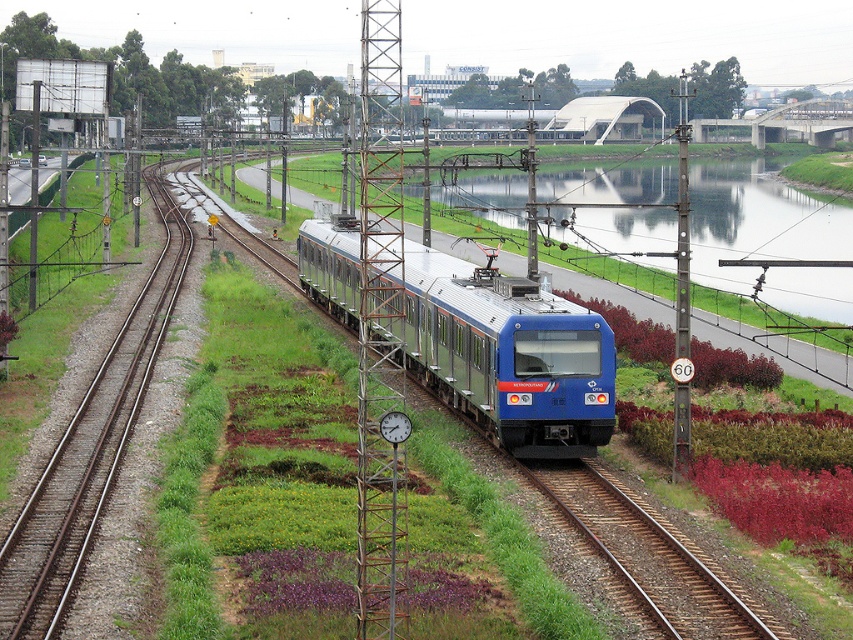
Which of these two, reflective glass waterway at center or blue metallic train at center, stands taller?

reflective glass waterway at center

Can you confirm if reflective glass waterway at center is positioned to the right of blue metallic train at center?

Correct, you'll find reflective glass waterway at center to the right of blue metallic train at center.

Who is more distant from viewer, [704,216] or [405,301]?

The point [704,216] is behind.

Where is `reflective glass waterway at center`? The height and width of the screenshot is (640, 853). reflective glass waterway at center is located at coordinates (757, 212).